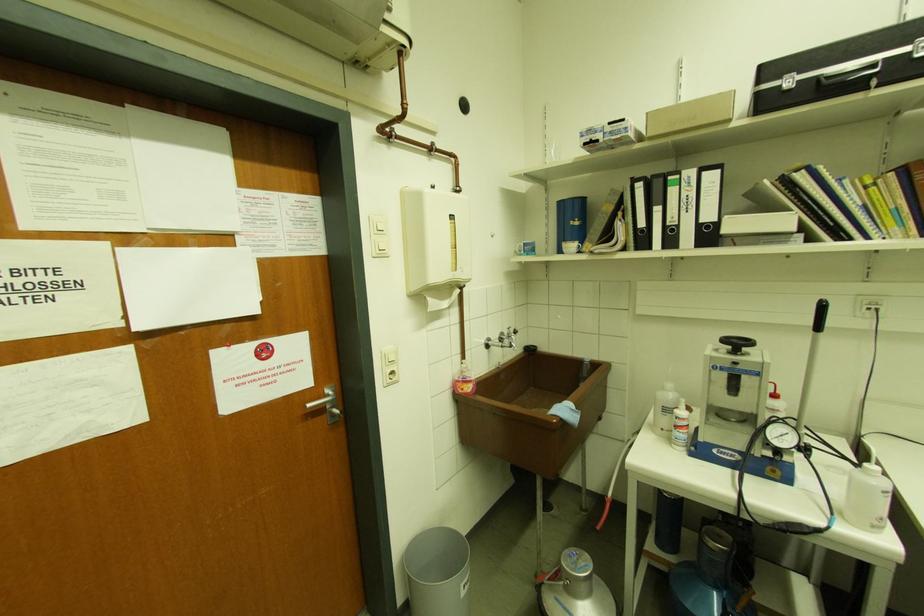
The image size is (924, 616). In order to click on white squeeze bottle in this screenshot , I will do `click(868, 496)`.